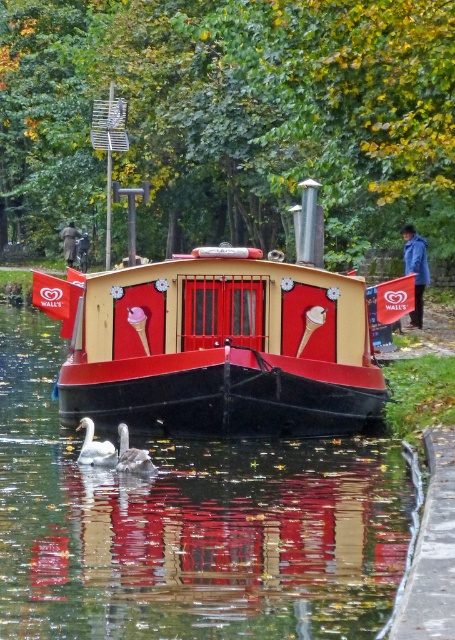
Question: Does blue fabric jacket at right have a larger size compared to white matte duck at lower center?

Choices:
 (A) yes
 (B) no

Answer: (B)

Question: Which point is closer to the camera?

Choices:
 (A) (80, 464)
 (B) (193, 336)
 (C) (65, 536)
 (D) (70, 244)

Answer: (C)

Question: Where is smooth black water at center located in relation to blue fabric jacket at right in the image?

Choices:
 (A) below
 (B) above

Answer: (A)

Question: Does matte red boat at center have a lesser width compared to blue fabric jacket at right?

Choices:
 (A) no
 (B) yes

Answer: (B)

Question: Considering the real-world distances, which object is farthest from the white matte duck at lower center?

Choices:
 (A) white glossy swan at lower left
 (B) dark brown leather jacket at center
 (C) smooth black water at center

Answer: (B)

Question: Which of the following is the closest to the observer?

Choices:
 (A) dark brown leather jacket at center
 (B) matte red boat at center

Answer: (B)